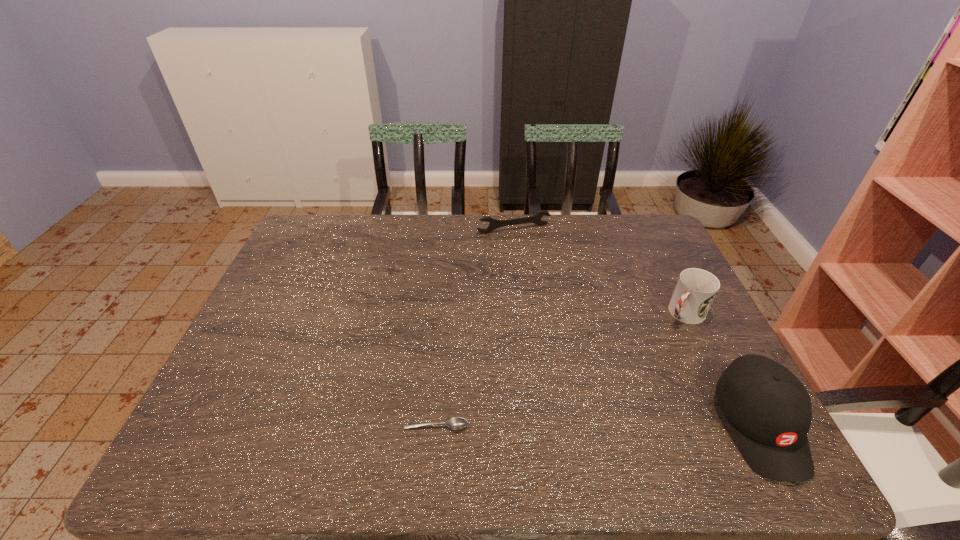
This screenshot has height=540, width=960. In the image, there is a desktop. Find the location of `vacant area at the near edge`. vacant area at the near edge is located at coordinates (368, 417).

This screenshot has width=960, height=540. In the image, there is a desktop. Identify the location of vacant space at the left edge. (268, 310).

At what (x,y) coordinates should I click in order to perform the action: click on vacant space at the right edge of the desktop. Please return your answer as a coordinate pair (x, y). The width and height of the screenshot is (960, 540). Looking at the image, I should click on (701, 354).

Where is `free region at the far right corner of the desktop`? This screenshot has height=540, width=960. free region at the far right corner of the desktop is located at coordinates [643, 233].

The image size is (960, 540). Find the location of `free area in between the baseball cap and the farthest object`. free area in between the baseball cap and the farthest object is located at coordinates (636, 327).

The height and width of the screenshot is (540, 960). In order to click on vacant point located between the soupspoon and the cup in this screenshot , I will do `click(560, 369)`.

Where is `free point between the second farthest object and the baseball cap`? free point between the second farthest object and the baseball cap is located at coordinates (722, 369).

Locate an element on the screen. The height and width of the screenshot is (540, 960). free area in between the baseball cap and the second object from left to right is located at coordinates (636, 327).

Where is `free space between the baseball cap and the third nearest object`? This screenshot has height=540, width=960. free space between the baseball cap and the third nearest object is located at coordinates (722, 369).

Find the location of a particular element. The image size is (960, 540). unoccupied position between the shortest object and the baseball cap is located at coordinates (598, 426).